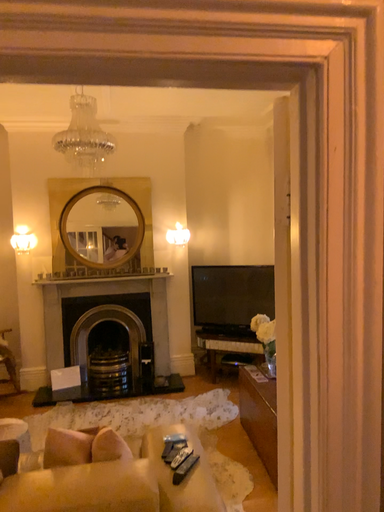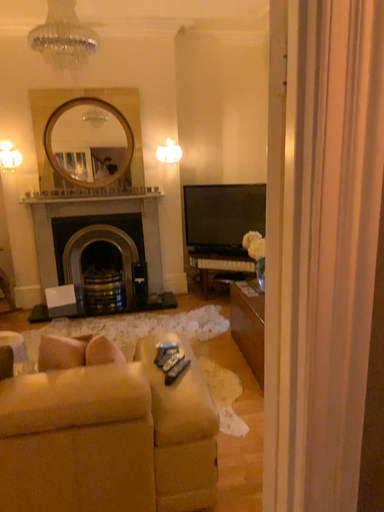
Question: Which way did the camera rotate in the video?

Choices:
 (A) rotated upward
 (B) rotated downward

Answer: (B)